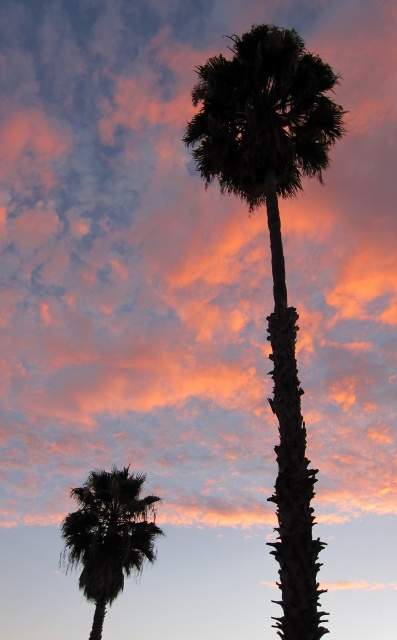
Question: Which point is closer to the camera?

Choices:
 (A) [x=273, y=308]
 (B) [x=80, y=499]

Answer: (A)

Question: Does silhouette palm tree at center appear on the left side of silhouette palm at lower left?

Choices:
 (A) no
 (B) yes

Answer: (A)

Question: Among these points, which one is farthest from the camera?

Choices:
 (A) (69, 568)
 (B) (296, 186)

Answer: (A)

Question: Is silhouette palm tree at center to the left of silhouette palm at lower left from the viewer's perspective?

Choices:
 (A) yes
 (B) no

Answer: (B)

Question: Can you confirm if silhouette palm tree at center is bigger than silhouette palm at lower left?

Choices:
 (A) yes
 (B) no

Answer: (A)